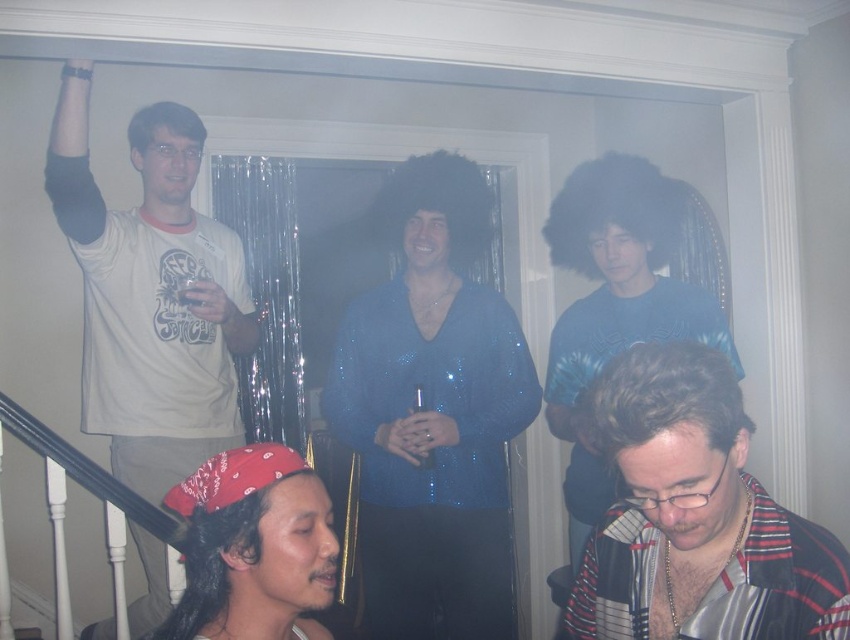
You are at the point labeled point (428, 340) and want to walk to the door frame behind you. Is there a clear path to the door frame without passing through point (565, 225)?

Yes, since point (428, 340) is in front of point (565, 225), you can walk directly to the door frame without passing through point (565, 225).